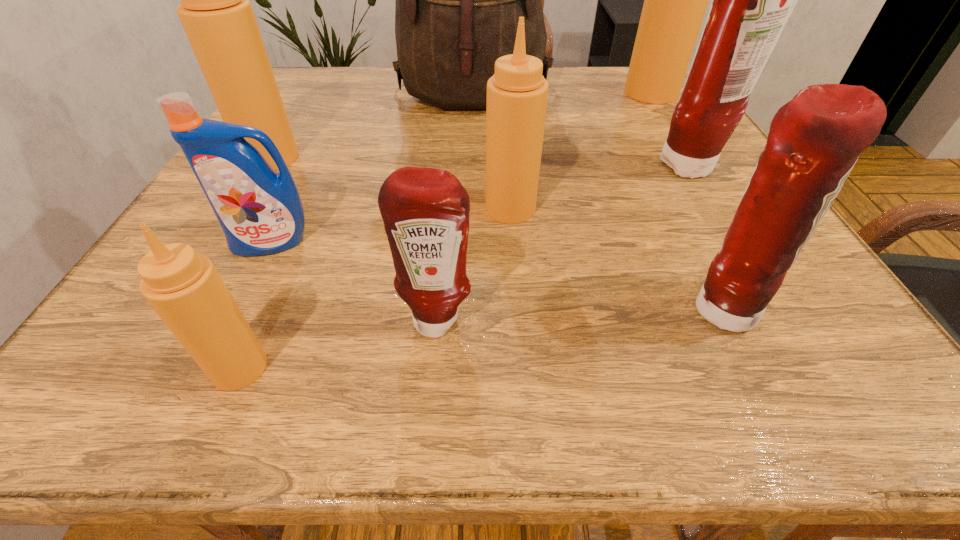
I want to click on backpack, so click(x=458, y=0).

Locate an element on the screen. the biggest tan condiment is located at coordinates (675, 0).

Identify the location of the tallest condiment. (675, 0).

In order to click on the farthest red condiment in this screenshot , I will do coord(752,1).

This screenshot has width=960, height=540. Identify the location of the third nearest tan condiment. (216, 14).

Locate an element on the screen. The width and height of the screenshot is (960, 540). the leftmost condiment is located at coordinates (216, 14).

Locate an element on the screen. The image size is (960, 540). the third biggest tan condiment is located at coordinates (517, 93).

Locate an element on the screen. The height and width of the screenshot is (540, 960). the fifth nearest object is located at coordinates (517, 93).

The height and width of the screenshot is (540, 960). I want to click on the second smallest red condiment, so click(x=814, y=141).

Locate an element on the screen. The image size is (960, 540). the fourth nearest object is located at coordinates click(260, 211).